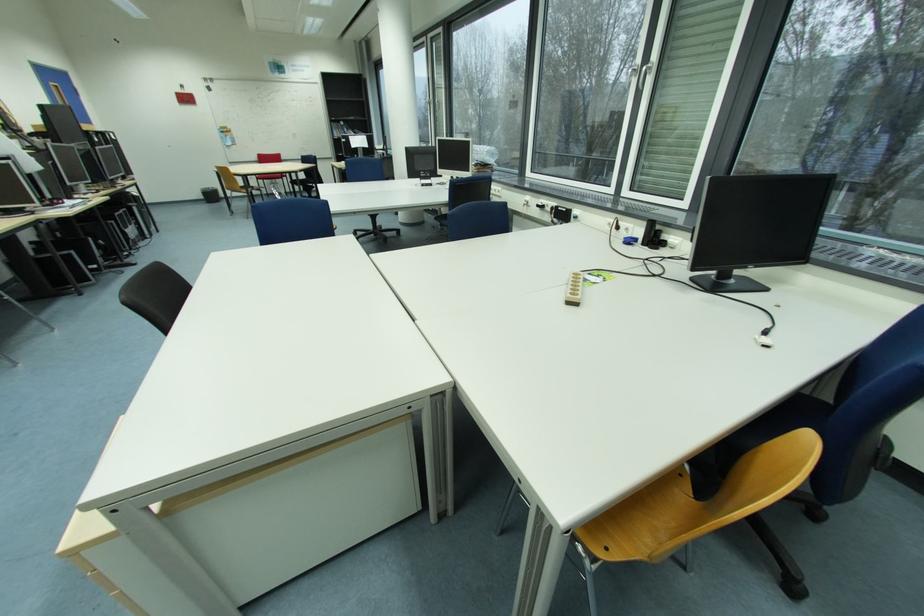
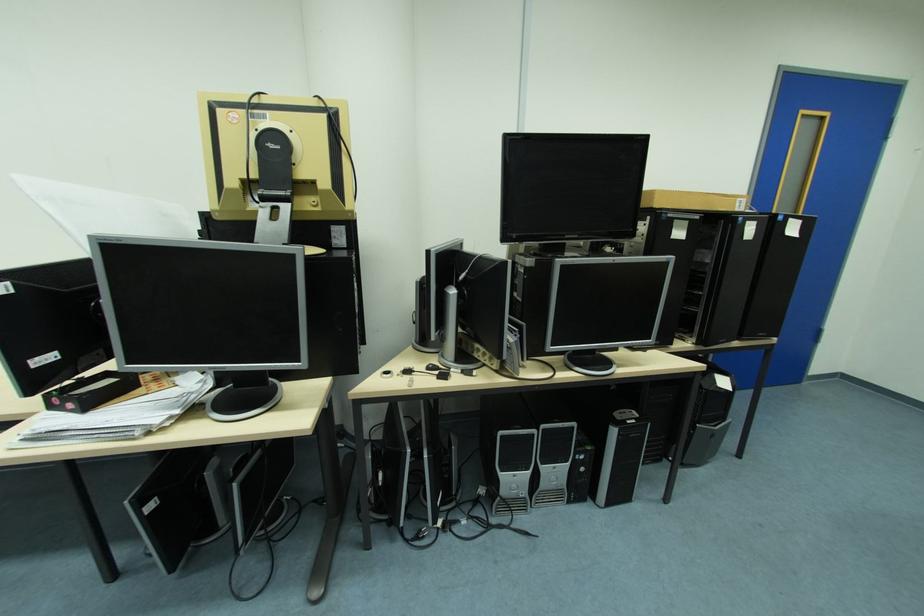
Where in the second image is the point corresponding to (x=141, y=209) from the first image?

(621, 432)